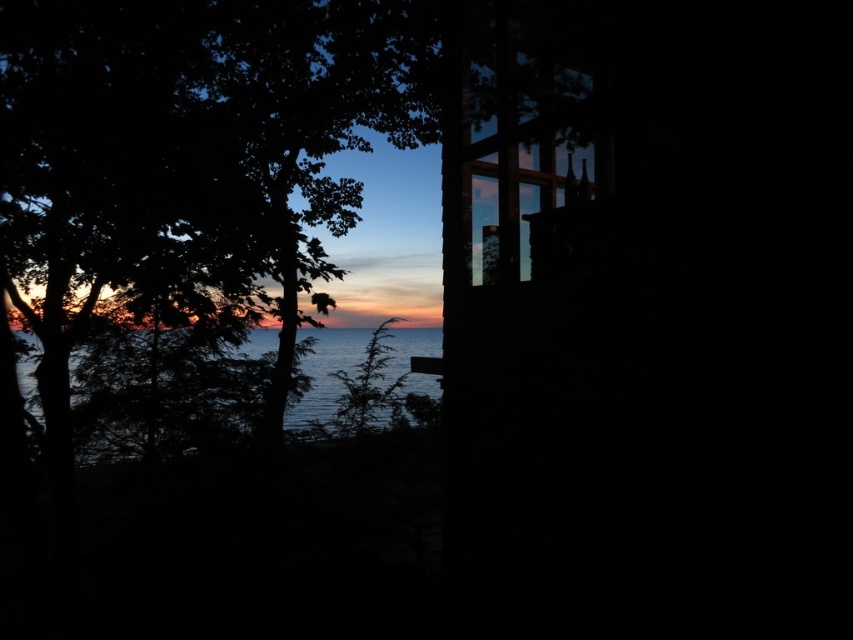
Question: Which object appears closest to the camera in this image?

Choices:
 (A) transparent glass window at center
 (B) dark green leafy tree at left

Answer: (B)

Question: Can you confirm if transparent glass window at center is bigger than blue water at left?

Choices:
 (A) no
 (B) yes

Answer: (A)

Question: Which of the following is the farthest from the observer?

Choices:
 (A) (425, 374)
 (B) (109, 134)
 (C) (561, 65)

Answer: (A)

Question: Estimate the real-world distances between objects in this image. Which object is closer to the transparent glass window at center?

Choices:
 (A) dark green leafy tree at left
 (B) blue water at left

Answer: (A)

Question: Does dark green leafy tree at left have a larger size compared to transparent glass window at center?

Choices:
 (A) no
 (B) yes

Answer: (B)

Question: Is transparent glass window at center further to the viewer compared to blue water at left?

Choices:
 (A) no
 (B) yes

Answer: (A)